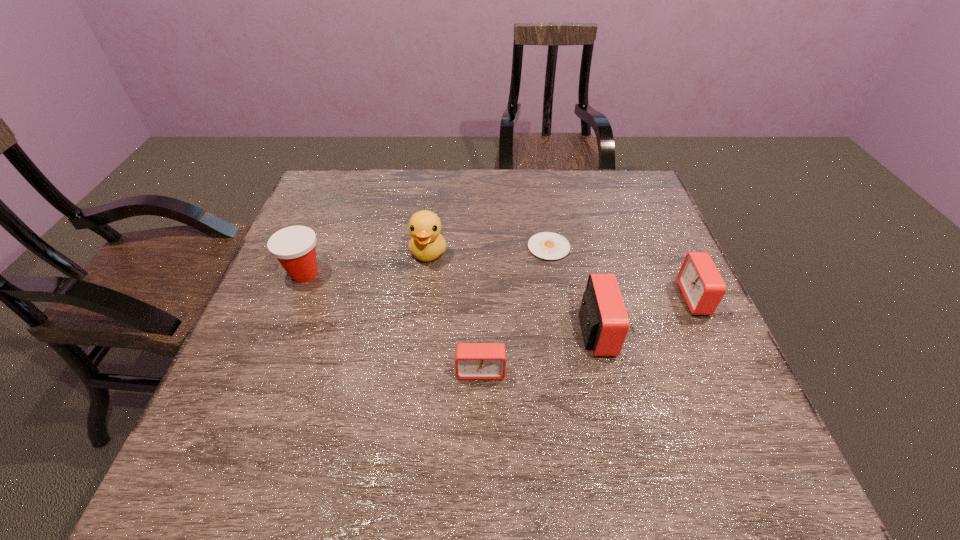
This screenshot has height=540, width=960. In order to click on free space at the left edge of the desktop in this screenshot , I will do `click(336, 260)`.

You are a GUI agent. You are given a task and a screenshot of the screen. Output one action in this format:
    pyautogui.click(x=<x>, y=<y>)
    Task: Click on the blank space at the right edge
    This screenshot has height=540, width=960.
    Given the screenshot: What is the action you would take?
    pyautogui.click(x=678, y=262)

The width and height of the screenshot is (960, 540). What are the coordinates of `free space at the far right corner of the desktop` in the screenshot? It's located at (625, 184).

You are a GUI agent. You are given a task and a screenshot of the screen. Output one action in this format:
    pyautogui.click(x=<x>, y=<y>)
    Task: Click on the vacant space at the near right corner of the desktop
    Image resolution: width=960 pixels, height=540 pixels.
    Given the screenshot: What is the action you would take?
    pyautogui.click(x=678, y=415)

Locate an element on the screen. The height and width of the screenshot is (540, 960). vacant region between the second alarm clock from right to left and the rightmost alarm clock is located at coordinates (645, 315).

Locate an element on the screen. The image size is (960, 540). free space between the tallest alarm clock and the egg yolk is located at coordinates (572, 289).

Locate an element on the screen. The height and width of the screenshot is (540, 960). vacant point located between the rightmost object and the fifth object from right to left is located at coordinates (562, 275).

The width and height of the screenshot is (960, 540). What are the coordinates of `empty location between the rightmost alarm clock and the duck` in the screenshot? It's located at (562, 275).

Find the location of a particular element. free spot between the second alarm clock from right to left and the rightmost object is located at coordinates (645, 315).

At what (x,y) coordinates should I click in order to perform the action: click on free space between the leftmost object and the nearest object. Please return your answer as a coordinate pair (x, y). Looking at the image, I should click on (393, 322).